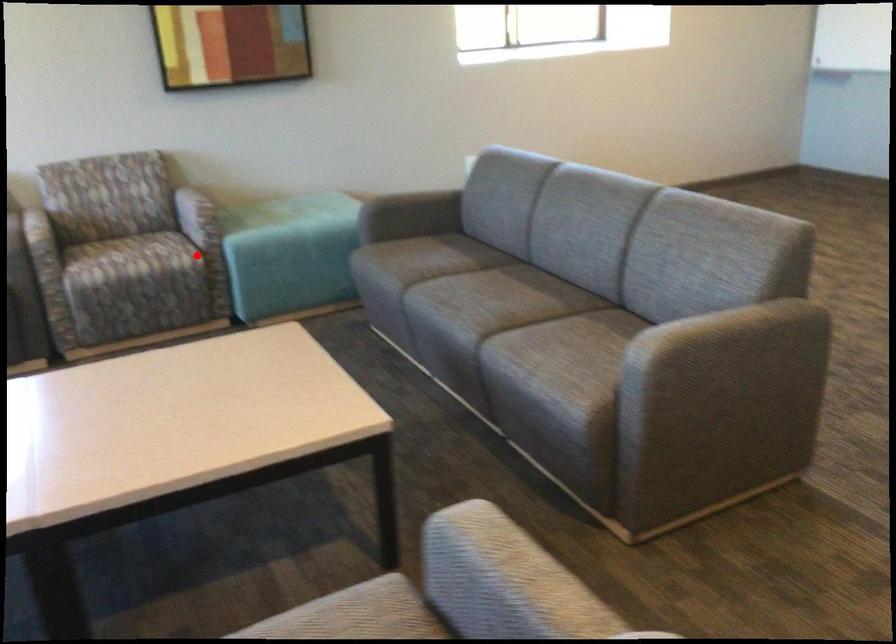
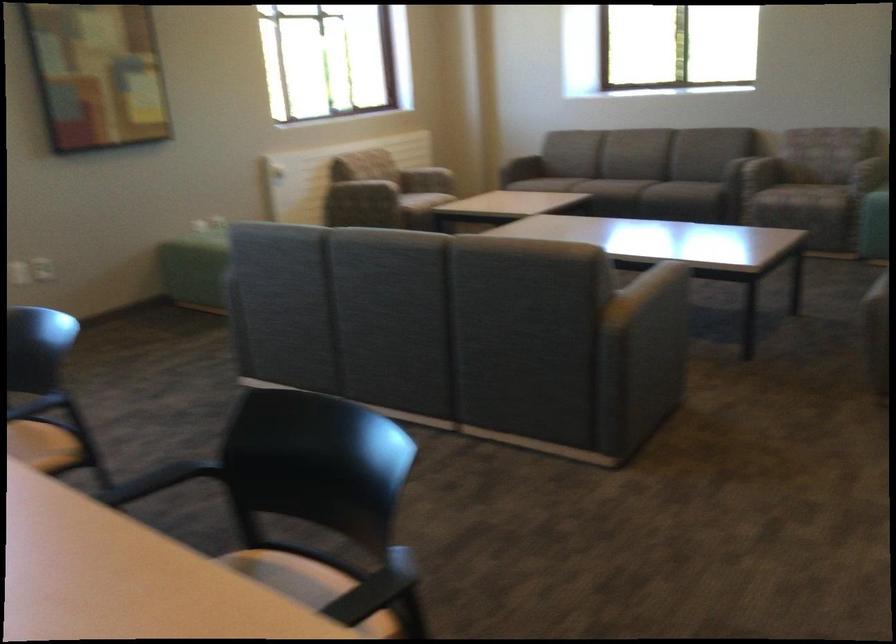
Where in the second image is the point corresponding to the highlighted location from the first image?

(807, 184)